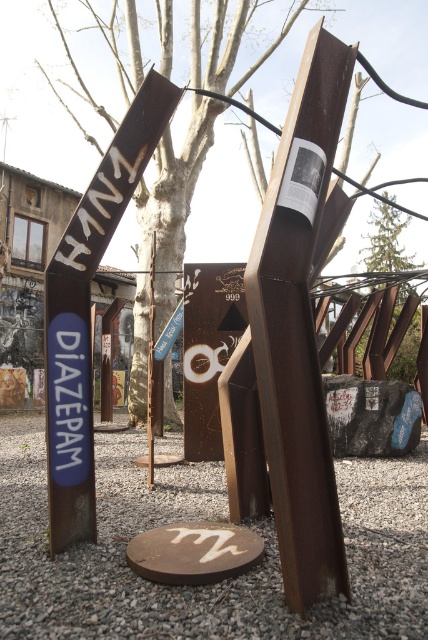
You are an artist planning to place a new sculpture in the center of the outdoor art installation. The existing rusty gravel at center is located at coordinates point 0.814, 0.463. Is there enough space to place your sculpture here without overlapping the gravel?

The rusty gravel at center is located at point (198, 520). Since the sculpture would be placed in the center where the gravel is, there isn not enough space without overlapping.